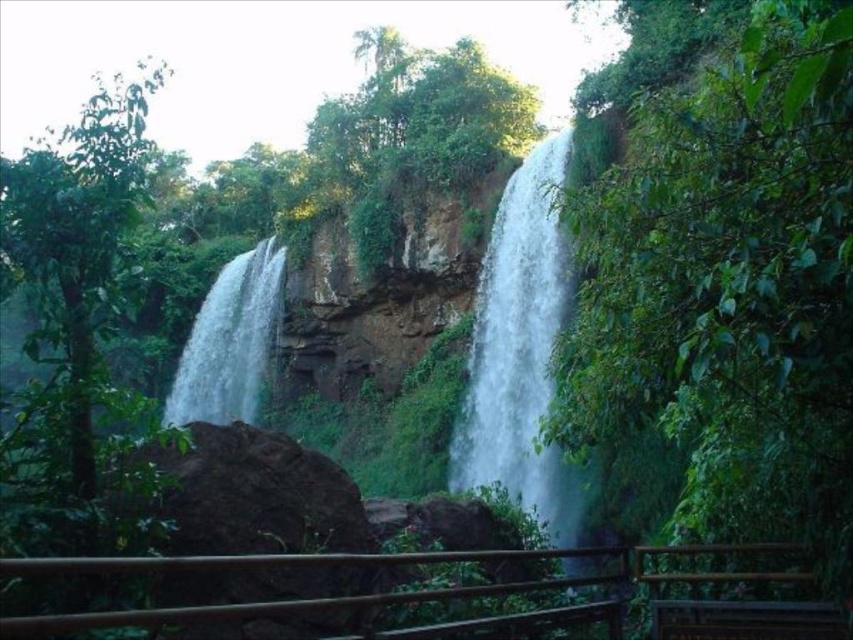
Question: Can you confirm if white frothy water at center is positioned to the right of white smooth waterfall at left?

Choices:
 (A) no
 (B) yes

Answer: (B)

Question: Is white frothy water at center to the left of white smooth waterfall at left from the viewer's perspective?

Choices:
 (A) no
 (B) yes

Answer: (A)

Question: Among these objects, which one is nearest to the camera?

Choices:
 (A) white frothy water at center
 (B) white smooth waterfall at left

Answer: (A)

Question: Can you confirm if brown wooden rail at lower center is positioned to the right of white smooth waterfall at left?

Choices:
 (A) yes
 (B) no

Answer: (A)

Question: Considering the real-world distances, which object is farthest from the brown wooden rail at lower center?

Choices:
 (A) white smooth waterfall at left
 (B) white frothy water at center

Answer: (A)

Question: Estimate the real-world distances between objects in this image. Which object is farther from the brown wooden rail at lower center?

Choices:
 (A) white smooth waterfall at left
 (B) white frothy water at center

Answer: (A)